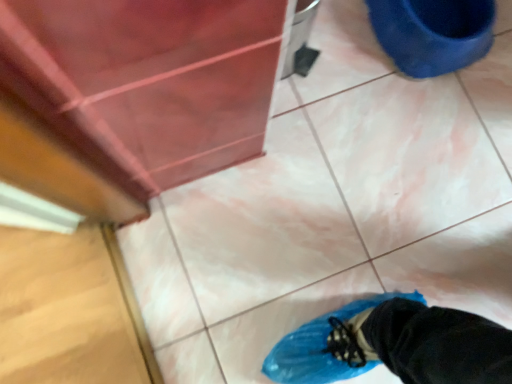
This screenshot has width=512, height=384. What do you see at coordinates (433, 33) in the screenshot? I see `blue plastic toilet bowl at upper right` at bounding box center [433, 33].

In order to click on blue plastic toilet bowl at upper right in this screenshot , I will do `click(433, 33)`.

Identify the location of blue plastic toilet bowl at upper right. Image resolution: width=512 pixels, height=384 pixels. (433, 33).